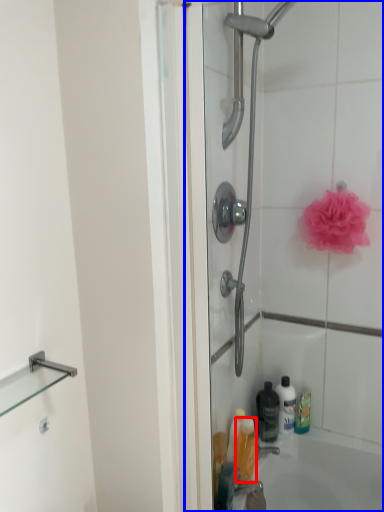
Question: Among these objects, which one is farthest to the camera, toiletry (highlighted by a red box) or shower door (highlighted by a blue box)?

Choices:
 (A) toiletry
 (B) shower door

Answer: (A)